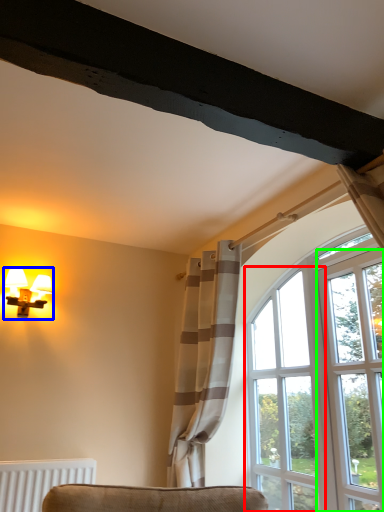
Question: Which object is the closest to the window (highlighted by a red box)? Choose among these: lamp (highlighted by a blue box) or screen door (highlighted by a green box).

Choices:
 (A) lamp
 (B) screen door

Answer: (B)